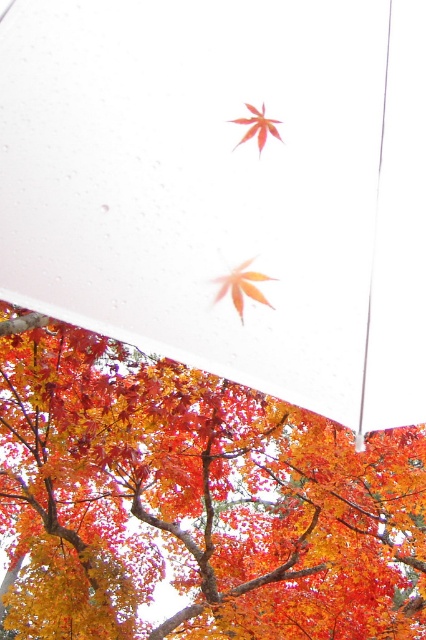
Can you confirm if shiny orange leaf at upper center is positioned to the left of shiny orange maple leaf at upper center?

Correct, you'll find shiny orange leaf at upper center to the left of shiny orange maple leaf at upper center.

Between shiny orange leaf at upper center and shiny orange maple leaf at upper center, which one has less height?

shiny orange maple leaf at upper center

Which is in front, point (301, 596) or point (261, 147)?

Point (261, 147) is in front.

Where is `shiny orange leaf at upper center`? shiny orange leaf at upper center is located at coordinates (196, 502).

Is transparent plastic canopy at center to the left of shiny orange leaf at upper center from the viewer's perspective?

In fact, transparent plastic canopy at center is to the right of shiny orange leaf at upper center.

Which is below, transparent plastic canopy at center or shiny orange leaf at upper center?

Positioned lower is shiny orange leaf at upper center.

Is point (40, 138) in front of point (331, 598)?

Yes, it is.

Locate an element on the screen. This screenshot has height=640, width=426. transparent plastic canopy at center is located at coordinates (226, 188).

Does transparent plastic canopy at center appear on the left side of orange matte maple leaf at center?

Incorrect, transparent plastic canopy at center is not on the left side of orange matte maple leaf at center.

Does transparent plastic canopy at center have a greater width compared to orange matte maple leaf at center?

Yes.

Is point (158, 76) less distant than point (250, 259)?

No, it is not.

The width and height of the screenshot is (426, 640). In order to click on transparent plastic canopy at center in this screenshot , I will do `click(226, 188)`.